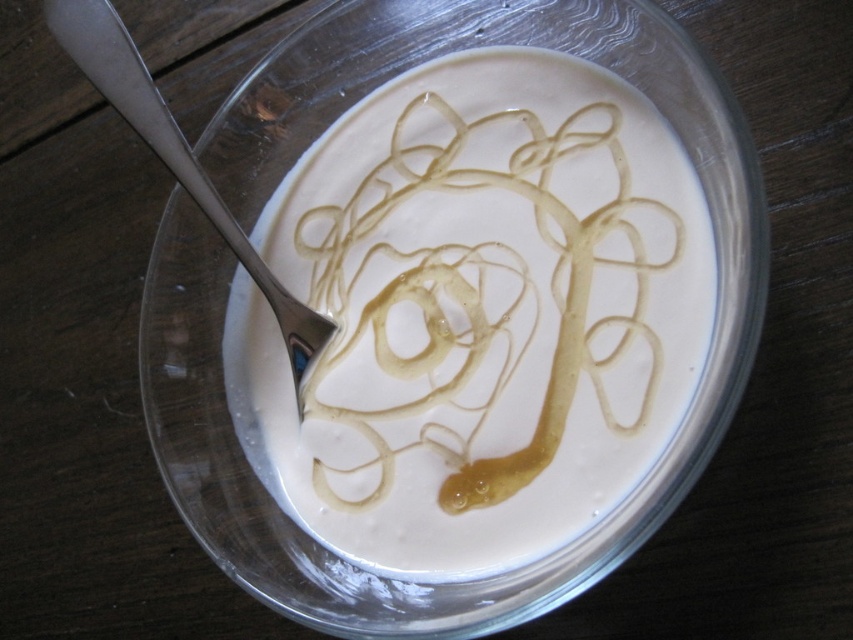
Question: Can you confirm if transparent glass bowl at center is positioned to the left of silver metallic spoon at upper left?

Choices:
 (A) no
 (B) yes

Answer: (A)

Question: In this image, where is transparent glass bowl at center located relative to silver metallic spoon at upper left?

Choices:
 (A) right
 (B) left

Answer: (A)

Question: Is transparent glass bowl at center in front of silver metallic spoon at upper left?

Choices:
 (A) yes
 (B) no

Answer: (A)

Question: Which of the following is the closest to the observer?

Choices:
 (A) (262, 496)
 (B) (131, 76)

Answer: (B)

Question: Which of the following is the farthest from the observer?

Choices:
 (A) (604, 531)
 (B) (273, 298)

Answer: (B)